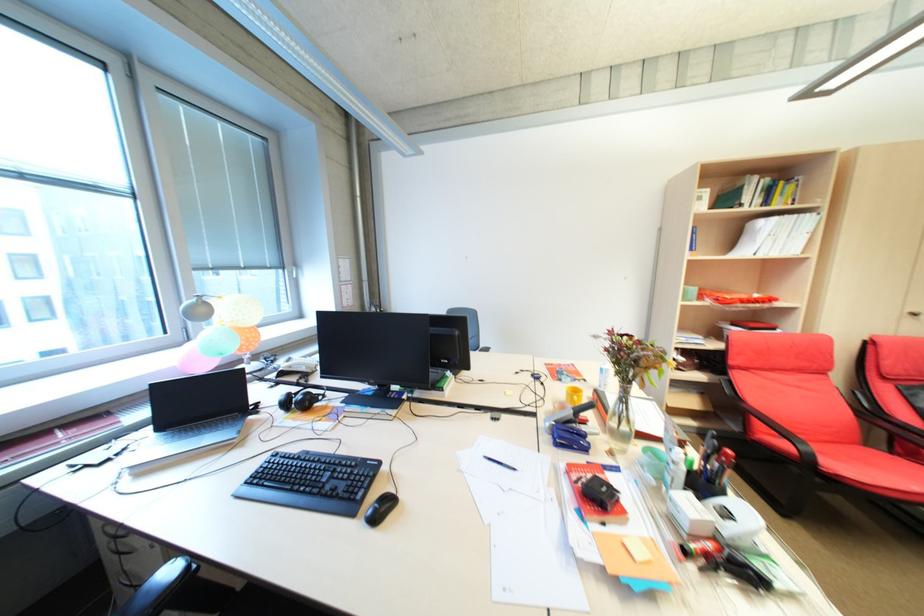
The location [573,395] corresponds to which object?

It refers to a yellow mug.